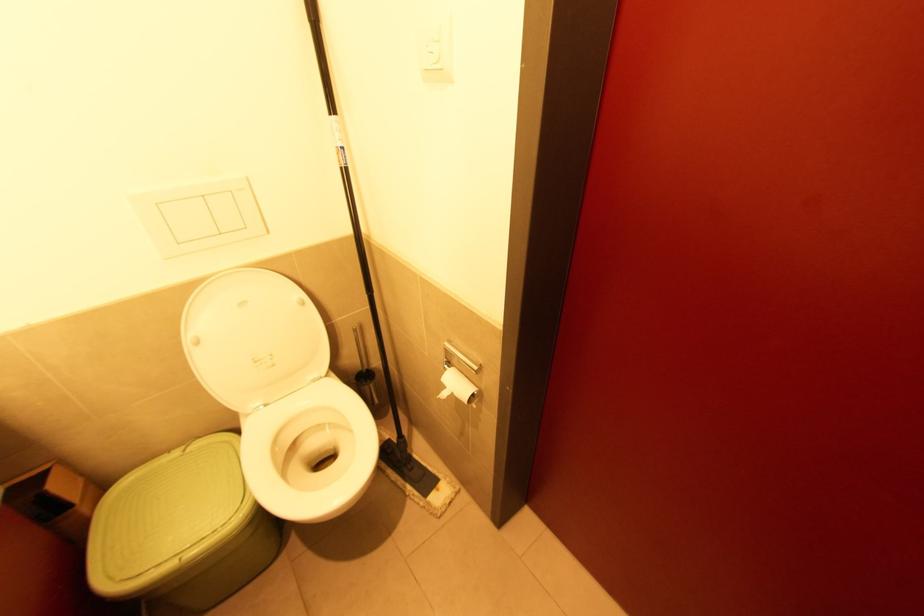
What do you see at coordinates (199, 215) in the screenshot? The image size is (924, 616). I see `the toilet flush buttons` at bounding box center [199, 215].